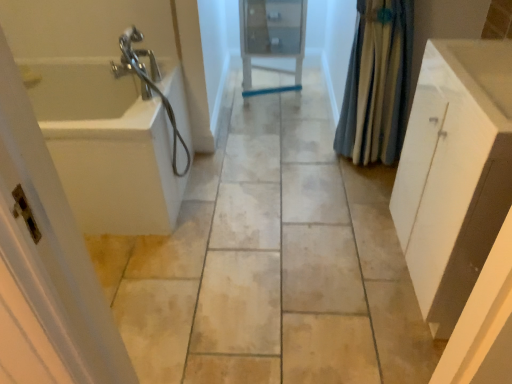
Question: Is white plastic screen door at left not near white matte cabinet at right?

Choices:
 (A) yes
 (B) no

Answer: (A)

Question: Does white plastic screen door at left have a lesser width compared to white matte cabinet at right?

Choices:
 (A) yes
 (B) no

Answer: (A)

Question: Is white plastic screen door at left bigger than white matte cabinet at right?

Choices:
 (A) no
 (B) yes

Answer: (A)

Question: Is white plastic screen door at left touching white matte cabinet at right?

Choices:
 (A) no
 (B) yes

Answer: (A)

Question: From a real-world perspective, is white plastic screen door at left physically above white matte cabinet at right?

Choices:
 (A) no
 (B) yes

Answer: (B)

Question: Is white plastic screen door at left further to camera compared to white matte cabinet at right?

Choices:
 (A) no
 (B) yes

Answer: (A)

Question: Is matte glass medicine cabinet at center positioned with its back to blue fabric shower curtain at right?

Choices:
 (A) no
 (B) yes

Answer: (A)

Question: Is matte glass medicine cabinet at center closer to camera compared to blue fabric shower curtain at right?

Choices:
 (A) no
 (B) yes

Answer: (A)

Question: Considering the relative positions of matte glass medicine cabinet at center and blue fabric shower curtain at right in the image provided, is matte glass medicine cabinet at center behind blue fabric shower curtain at right?

Choices:
 (A) no
 (B) yes

Answer: (B)

Question: Can you confirm if matte glass medicine cabinet at center is wider than blue fabric shower curtain at right?

Choices:
 (A) no
 (B) yes

Answer: (B)

Question: Is matte glass medicine cabinet at center aimed at blue fabric shower curtain at right?

Choices:
 (A) no
 (B) yes

Answer: (A)

Question: Is matte glass medicine cabinet at center to the left of blue fabric shower curtain at right from the viewer's perspective?

Choices:
 (A) yes
 (B) no

Answer: (A)

Question: Could white glossy sink at right be considered to be inside white matte cabinet at right?

Choices:
 (A) yes
 (B) no

Answer: (B)